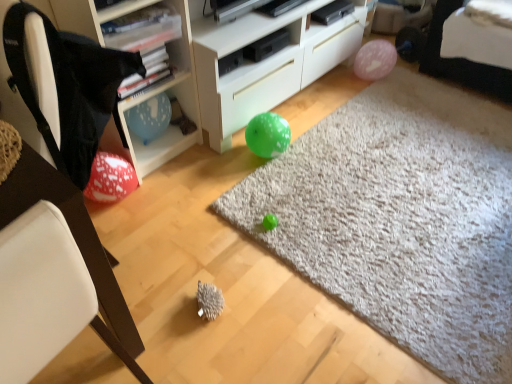
Question: Does green matte balloon at center turn towards white plastic chair at left?

Choices:
 (A) yes
 (B) no

Answer: (B)

Question: Is the surface of green matte balloon at center in direct contact with white plastic chair at left?

Choices:
 (A) yes
 (B) no

Answer: (B)

Question: From the image's perspective, is green matte balloon at center located beneath white plastic chair at left?

Choices:
 (A) no
 (B) yes

Answer: (A)

Question: Is green matte balloon at center positioned far away from white plastic chair at left?

Choices:
 (A) no
 (B) yes

Answer: (B)

Question: From the image's perspective, is green matte balloon at center on white plastic chair at left?

Choices:
 (A) no
 (B) yes

Answer: (B)

Question: Is green matte balloon at center outside of white plastic chair at left?

Choices:
 (A) no
 (B) yes

Answer: (B)

Question: Is blue paper balloon at upper left touching green matte balloon at center?

Choices:
 (A) yes
 (B) no

Answer: (B)

Question: Does blue paper balloon at upper left have a lesser height compared to green matte balloon at center?

Choices:
 (A) yes
 (B) no

Answer: (B)

Question: From the image's perspective, is blue paper balloon at upper left on top of green matte balloon at center?

Choices:
 (A) yes
 (B) no

Answer: (A)

Question: Considering the relative sizes of blue paper balloon at upper left and green matte balloon at center in the image provided, is blue paper balloon at upper left bigger than green matte balloon at center?

Choices:
 (A) no
 (B) yes

Answer: (A)

Question: Does blue paper balloon at upper left have a smaller size compared to green matte balloon at center?

Choices:
 (A) yes
 (B) no

Answer: (A)

Question: Is blue paper balloon at upper left not close to green matte balloon at center?

Choices:
 (A) no
 (B) yes

Answer: (A)

Question: Can you confirm if black fabric bean bag chair at left is positioned to the left of white plastic shelf at upper left?

Choices:
 (A) no
 (B) yes

Answer: (B)